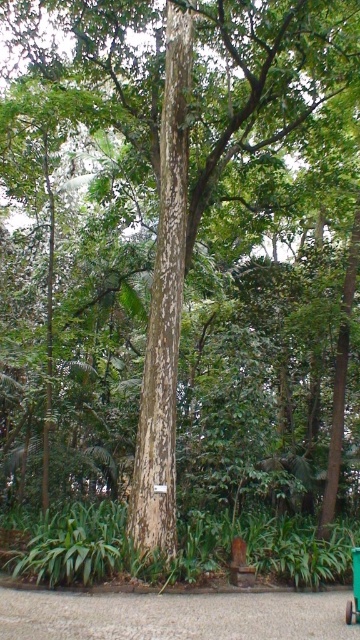
Question: Does speckled bark tree trunk at center appear over green plastic cart at center?

Choices:
 (A) no
 (B) yes

Answer: (B)

Question: Among these points, which one is farthest from the camera?

Choices:
 (A) (357, 580)
 (B) (137, 467)

Answer: (B)

Question: Is speckled bark tree trunk at center behind green plastic cart at center?

Choices:
 (A) no
 (B) yes

Answer: (B)

Question: Is speckled bark tree trunk at center positioned at the back of green plastic cart at center?

Choices:
 (A) no
 (B) yes

Answer: (B)